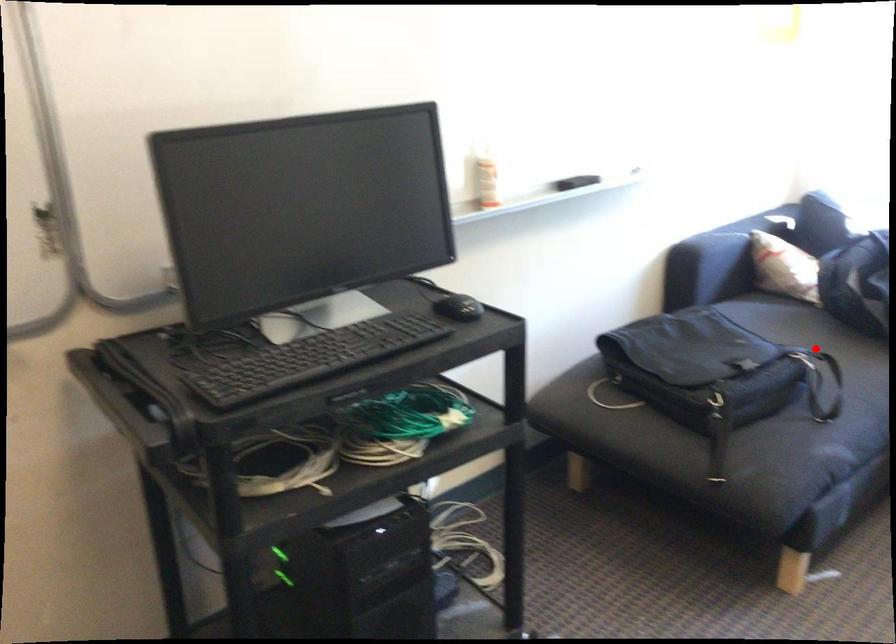
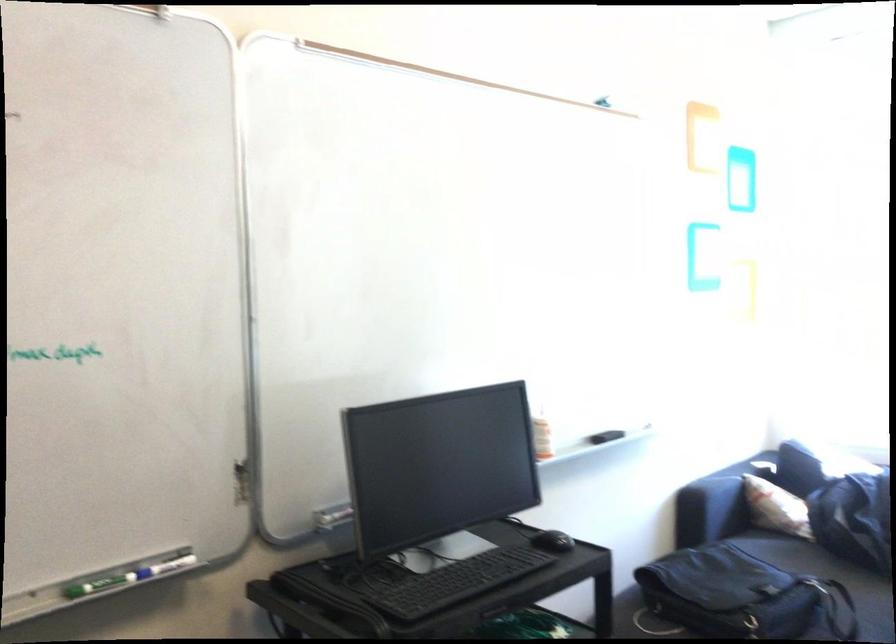
Find the pixel in the second image that matches the highlighted location in the first image.

(828, 576)